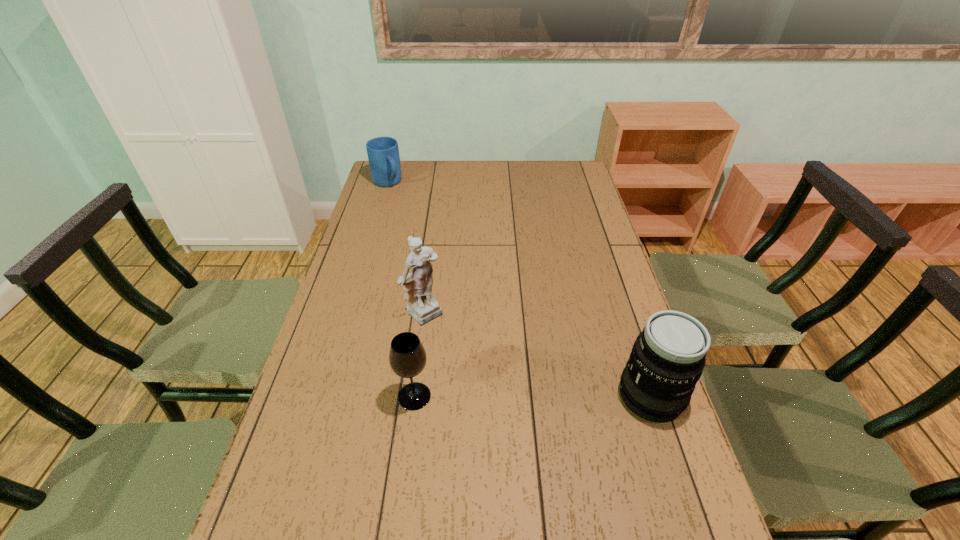
Where is `the second shortest object`? the second shortest object is located at coordinates (407, 356).

The width and height of the screenshot is (960, 540). Identify the location of telephoto lens. (668, 357).

Image resolution: width=960 pixels, height=540 pixels. What are the coordinates of `the tallest object` in the screenshot? It's located at (422, 305).

The width and height of the screenshot is (960, 540). What are the coordinates of `the third nearest object` in the screenshot? It's located at 422,305.

At what (x,y) coordinates should I click in order to perform the action: click on the shortest object. Please return your answer as a coordinate pair (x, y). Looking at the image, I should click on (383, 153).

Image resolution: width=960 pixels, height=540 pixels. Identify the location of the farthest object. (383, 153).

The image size is (960, 540). What are the coordinates of `free space located 0.210m on the back of the wineglass` in the screenshot? It's located at (423, 321).

You are a GUI agent. You are given a task and a screenshot of the screen. Output one action in this format:
    pyautogui.click(x=<x>, y=<y>)
    Task: Click on the vacant space situated on the left of the rightmost object
    
    Given the screenshot: What is the action you would take?
    pyautogui.click(x=546, y=396)

Where is `vacant space located 0.400m on the front-facing side of the second farthest object`? Image resolution: width=960 pixels, height=540 pixels. vacant space located 0.400m on the front-facing side of the second farthest object is located at coordinates (545, 412).

Where is `free space located on the front-facing side of the second farthest object`? free space located on the front-facing side of the second farthest object is located at coordinates (527, 396).